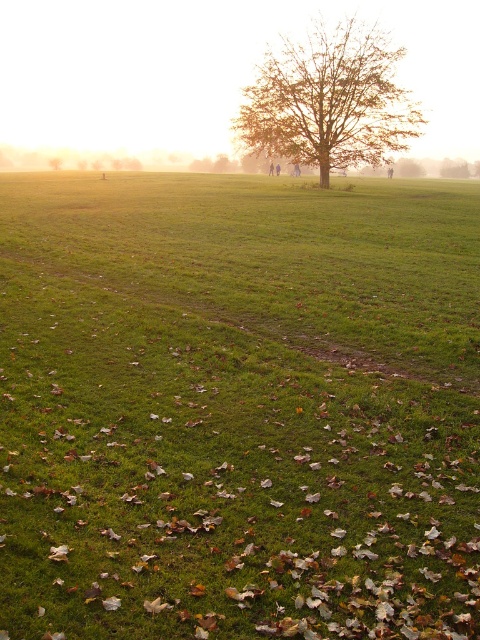
You are standing at the edge of the green grassy field at center and looking towards the brown textured tree at center. Which object is closer to you?

The green grassy field at center is closer to you because it is in front of the brown textured tree at center.

You are a hiker standing on the green grassy field at center and want to reach the brown textured tree at center. Given that your average walking speed is 3 feet per second, how many seconds will it take you to reach the tree?

The green grassy field at center and brown textured tree at center are 79.44 feet apart from each other. At a speed of 3 feet per second, dividing the distance by speed gives 79.44 divided by 3 equals approximately 26.48 seconds. So, it will take about 26.5 seconds to reach the tree.